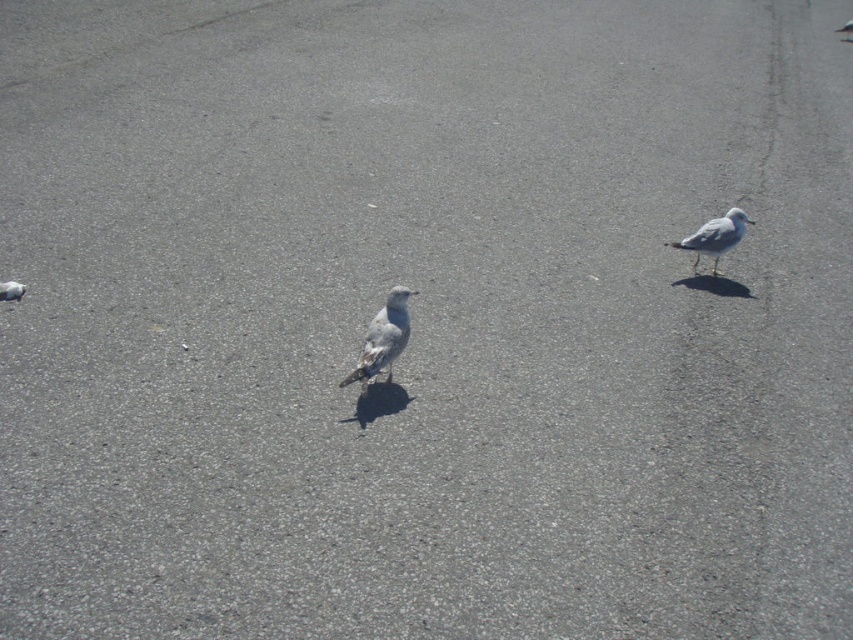
You are a photographer trying to capture a closeup of the white matte pigeon at right and the gray matte pigeon at lower left. If you want to focus on the smaller one first, which one should you aim your camera at?

The gray matte pigeon at lower left is smaller than the white matte pigeon at right, so you should aim your camera at the gray matte pigeon at lower left first.